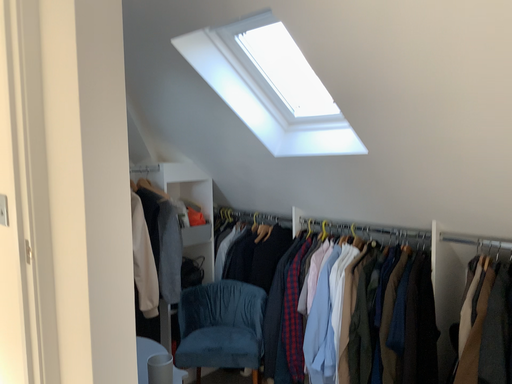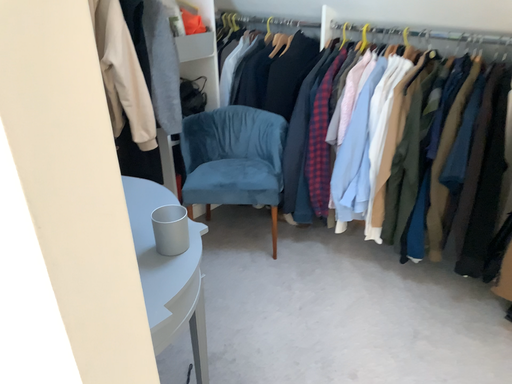
Question: Which way did the camera rotate in the video?

Choices:
 (A) rotated downward
 (B) rotated upward

Answer: (A)